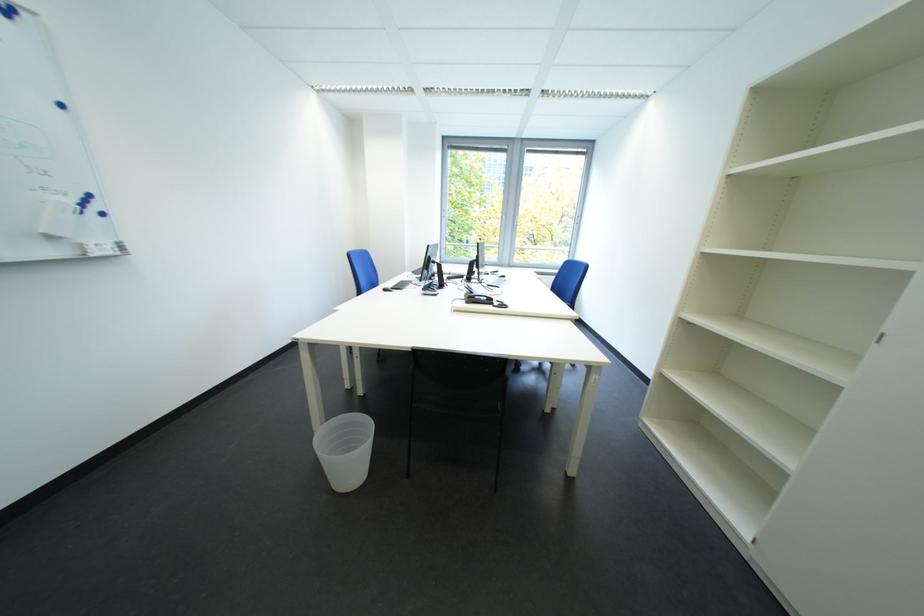
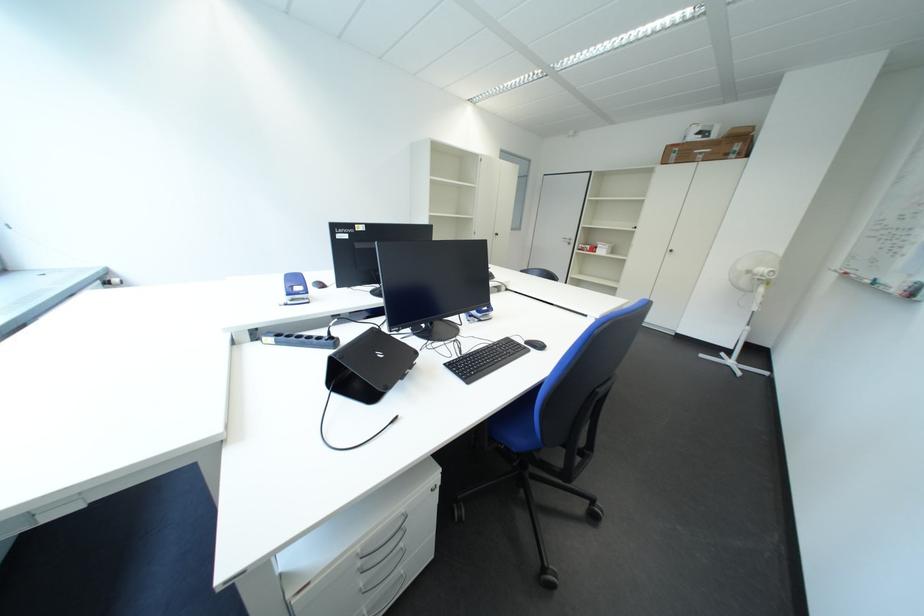
Question: I am providing you with two images of the same scene from different viewpoints. Please identify which objects are invisible in image2.

Choices:
 (A) chair sitting surface
 (B) phone handset
 (C) top drawer handle
 (D) silver door handle

Answer: (B)